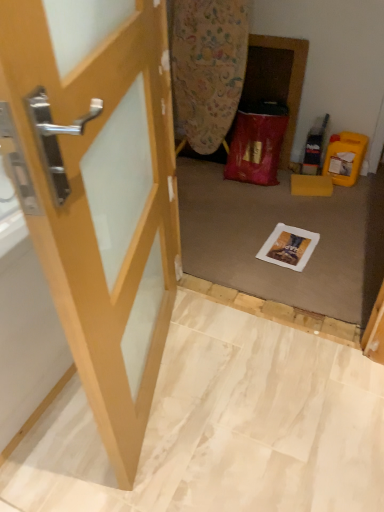
Describe the element at coordinates (98, 190) in the screenshot. I see `light wood door at left` at that location.

The width and height of the screenshot is (384, 512). In order to click on light wood door at left in this screenshot , I will do `click(98, 190)`.

Where is `light wood door at left`? The width and height of the screenshot is (384, 512). light wood door at left is located at coordinates (98, 190).